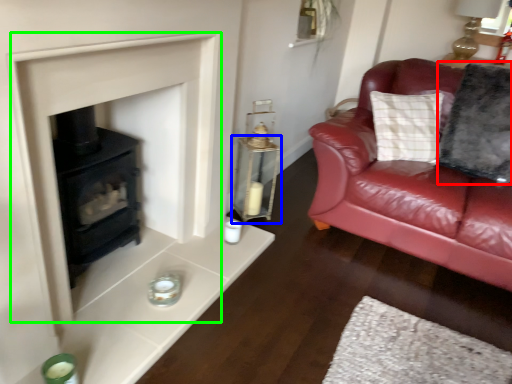
Question: Based on their relative distances, which object is nearer to pillow (highlighted by a red box)? Choose from table (highlighted by a blue box) and fireplace (highlighted by a green box).

Choices:
 (A) table
 (B) fireplace

Answer: (A)